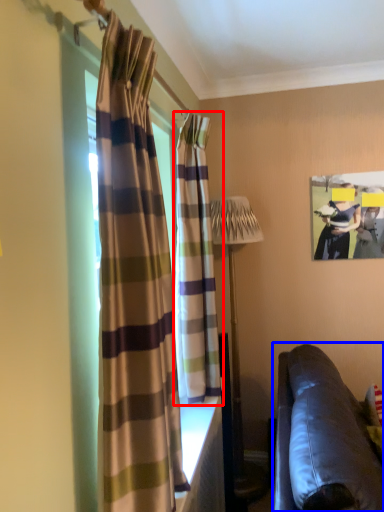
Question: Which point is further to the camera, curtain (highlighted by a red box) or studio couch (highlighted by a blue box)?

Choices:
 (A) curtain
 (B) studio couch

Answer: (A)